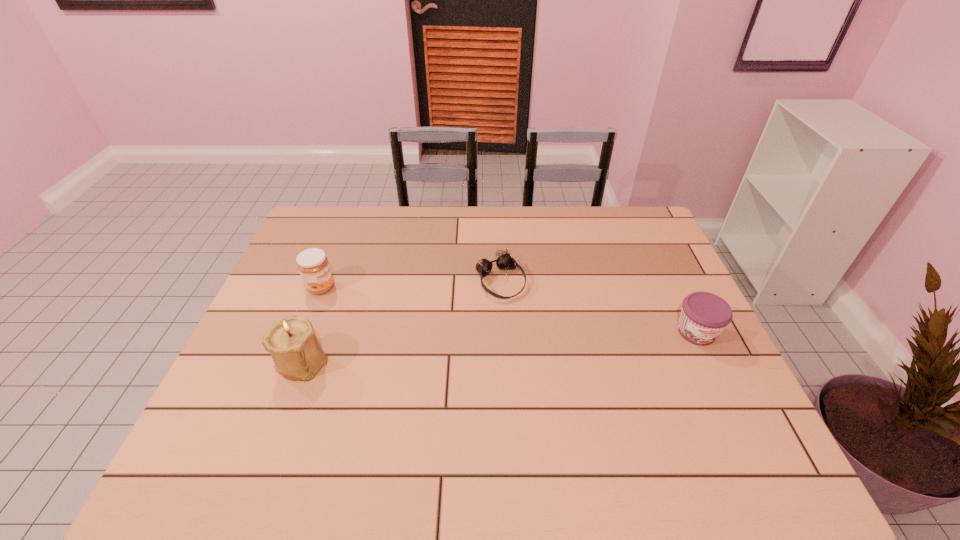
The width and height of the screenshot is (960, 540). What are the coordinates of `free space on the desktop that is between the tallest object and the nearer jam and is positioned on the front label of the taller jam` in the screenshot? It's located at (476, 348).

Find the location of `vacant space on the desktop that is between the tallest object and the right jam and is positioned through the lenses of the shortest object`. vacant space on the desktop that is between the tallest object and the right jam and is positioned through the lenses of the shortest object is located at coordinates (546, 343).